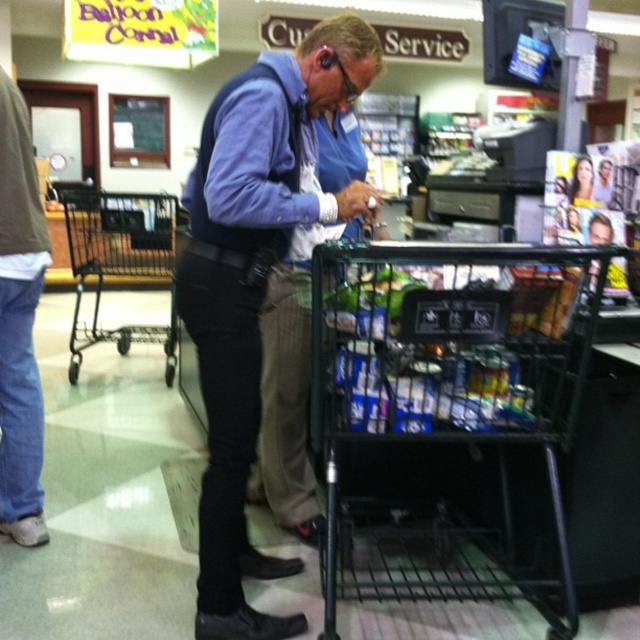
Question: Among these objects, which one is nearest to the camera?

Choices:
 (A) black metal shopping cart at lower center
 (B) black metal shopping cart at left
 (C) denim jeans at left

Answer: (A)

Question: Where is black metal shopping cart at lower center located in relation to black metal shopping cart at left in the image?

Choices:
 (A) below
 (B) above

Answer: (A)

Question: Which of the following is the closest to the observer?

Choices:
 (A) (148, 268)
 (B) (28, 392)
 (C) (500, 480)
 (D) (248, 218)

Answer: (D)

Question: Can you confirm if matte blue shirt at center is positioned above black metal shopping cart at left?

Choices:
 (A) yes
 (B) no

Answer: (B)

Question: Among these points, which one is farthest from the camera?

Choices:
 (A) [70, 232]
 (B) [326, 477]
 (C) [282, 152]

Answer: (A)

Question: Can you confirm if matte blue shirt at center is positioned to the right of black metal shopping cart at left?

Choices:
 (A) yes
 (B) no

Answer: (A)